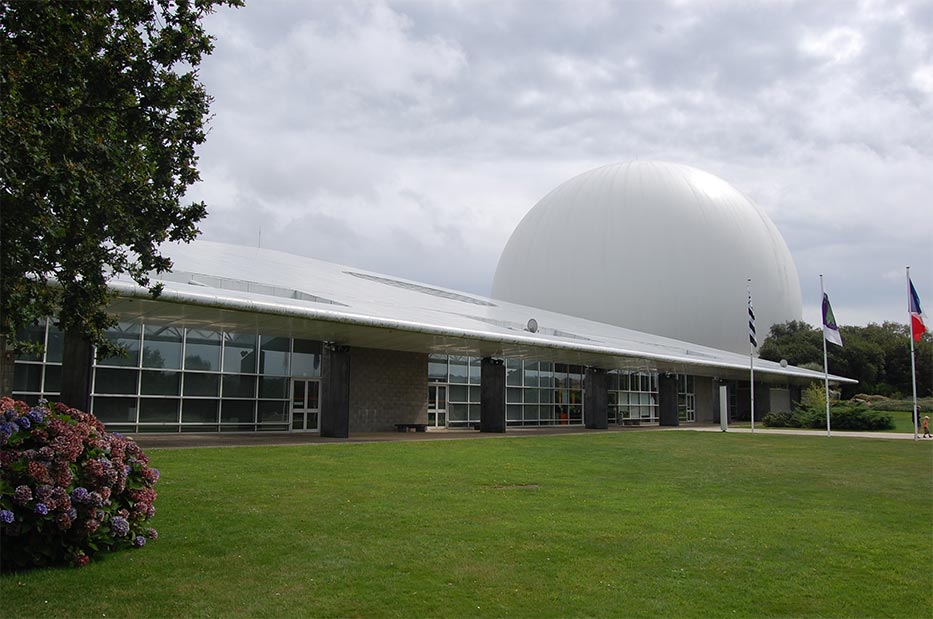
At what (x,y) coordinates should I click in order to perform the action: click on wall. Please return your answer as a coordinate pair (x, y). Looking at the image, I should click on (385, 396).